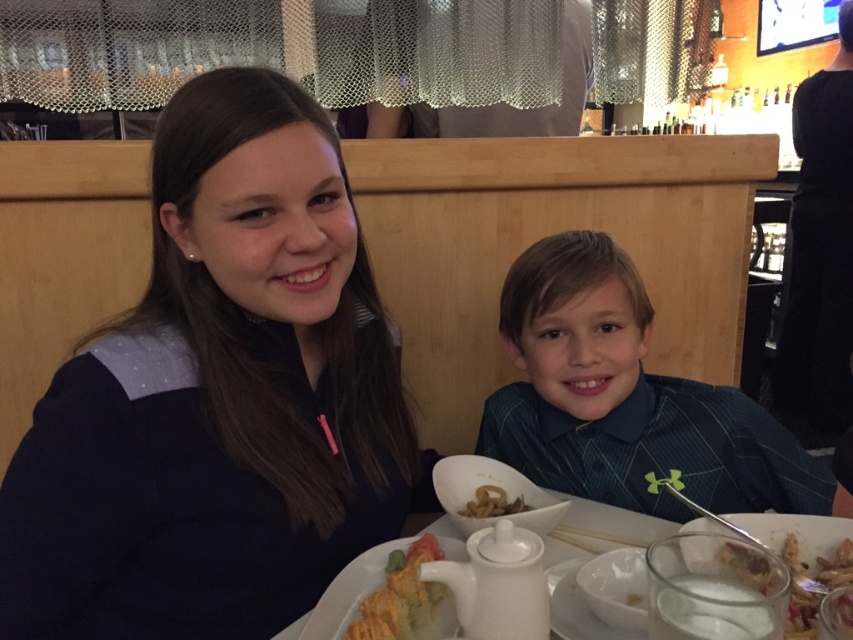
You are a waiter at the restaurant. You need to place a new drink order for the customer wearing the blue striped shirt at center. Where should you place the drink relative to the white creamy dessert at lower right?

The blue striped shirt at center is positioned over the white creamy dessert at lower right, so the drink should be placed to the side or above the dessert to avoid covering it.

You are a server at a restaurant and need to place a 10 cm tall coffee mug on the table. The table has the white glossy teapot at lower center and the white creamy dessert at lower right. Which object should you avoid placing the mug next to to prevent it from being knocked over?

You should avoid placing the mug next to the white glossy teapot at lower center because it is taller than the white creamy dessert at lower right and could potentially knock the mug over.

You are a photographer trying to capture a closeup of the white creamy dessert at lower right. The blue striped shirt at center is blocking your view. Can you tell me if the shirt is larger than the dessert?

The blue striped shirt at center is bigger than the white creamy dessert at lower right, so the shirt is indeed larger and may be blocking the view.